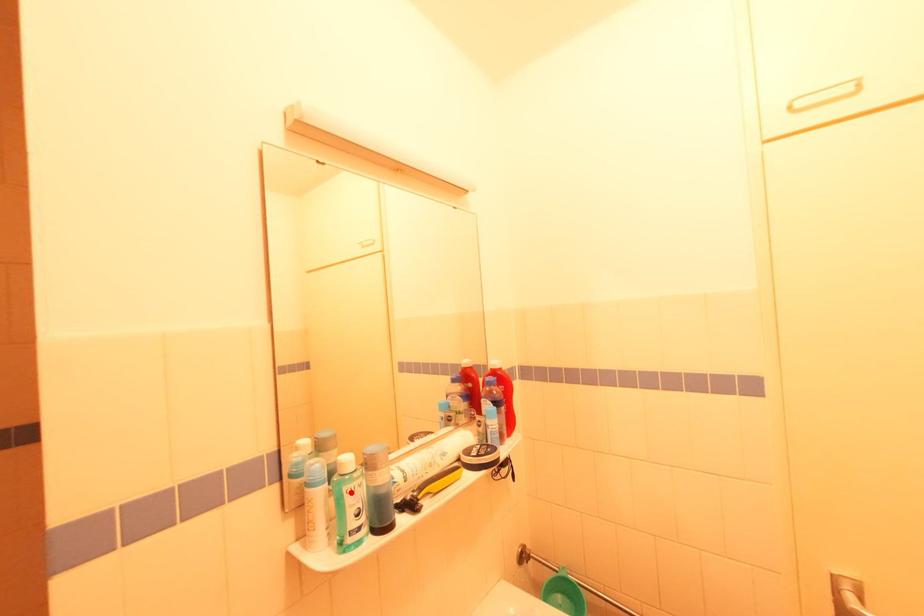
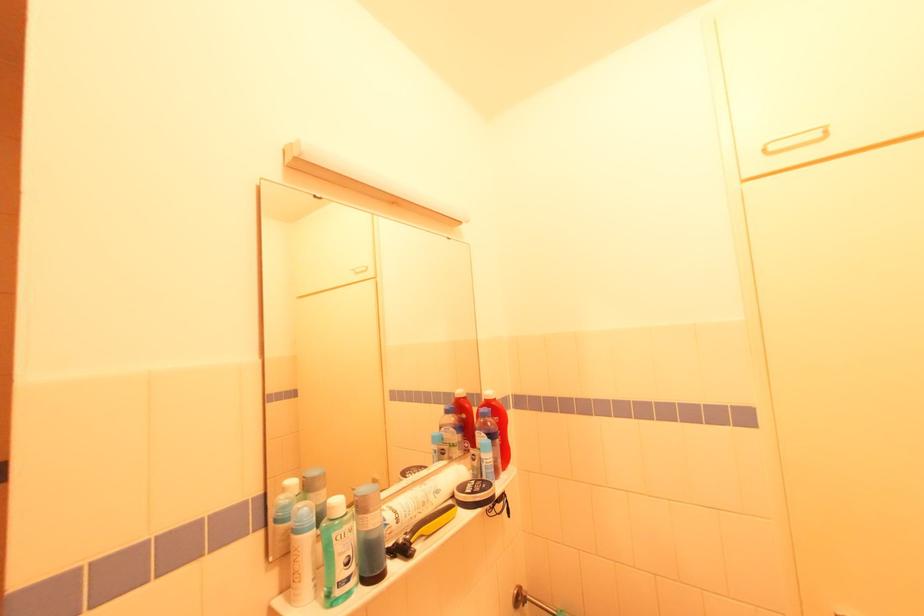
Question: I am providing you with two images of the same scene from different viewpoints. A red point is marked on the first image. At the location where the point appears in image 1, is it still visible in image 2?

Choices:
 (A) Yes
 (B) No

Answer: (A)